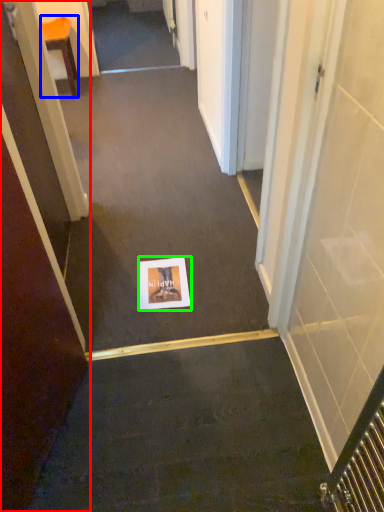
Question: Which object is the farthest from door (highlighted by a red box)? Choose among these: furniture (highlighted by a blue box) or postcard (highlighted by a green box).

Choices:
 (A) furniture
 (B) postcard

Answer: (A)